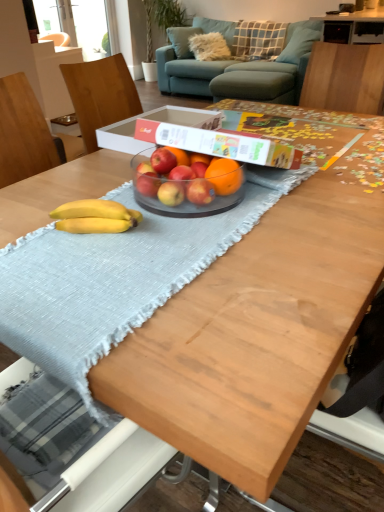
I want to click on free space in front of yellow matte bananas at center, so click(x=95, y=272).